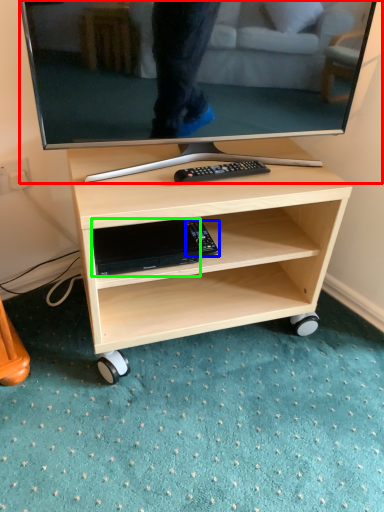
Question: Considering the real-world distances, which object is closest to television (highlighted by a red box)? equipment (highlighted by a blue box) or gadget (highlighted by a green box).

Choices:
 (A) equipment
 (B) gadget

Answer: (B)